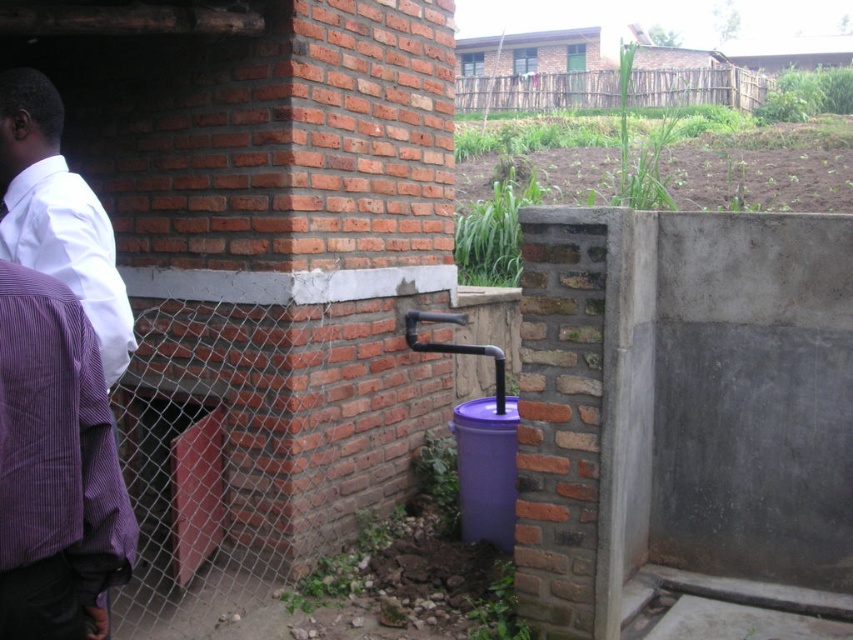
Question: Which of the following is the farthest from the observer?

Choices:
 (A) (625, 100)
 (B) (22, 236)
 (C) (50, 529)

Answer: (A)

Question: Which of the following is the closest to the observer?

Choices:
 (A) purple striped robe at left
 (B) white shirt at left
 (C) wooden fence at upper center

Answer: (A)

Question: Which is nearer to the white shirt at left?

Choices:
 (A) purple striped robe at left
 (B) wooden fence at upper center

Answer: (A)

Question: Is white shirt at left thinner than wooden fence at upper center?

Choices:
 (A) yes
 (B) no

Answer: (B)

Question: Is purple striped robe at left to the right of wooden fence at upper center from the viewer's perspective?

Choices:
 (A) no
 (B) yes

Answer: (A)

Question: In this image, where is purple striped robe at left located relative to wooden fence at upper center?

Choices:
 (A) right
 (B) left

Answer: (B)